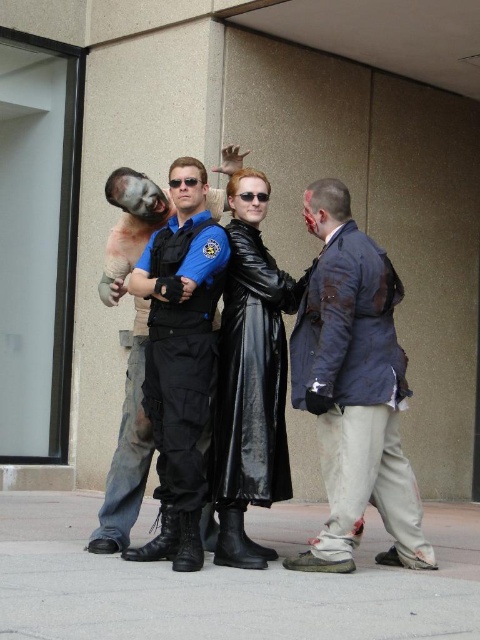
Question: Does matte black uniform at center have a greater width compared to black matte sunglasses at center?

Choices:
 (A) yes
 (B) no

Answer: (A)

Question: Is dark blue suit at right below sunglasses at center?

Choices:
 (A) yes
 (B) no

Answer: (A)

Question: Which is farther from the black matte sunglasses at center?

Choices:
 (A) matte black uniform at center
 (B) sunglasses at center
 (C) dark blue suit at right

Answer: (C)

Question: Considering the real-world distances, which object is farthest from the dark blue suit at right?

Choices:
 (A) sunglasses at center
 (B) black matte sunglasses at center
 (C) matte black uniform at center

Answer: (A)

Question: Does dark blue suit at right have a greater width compared to black matte sunglasses at center?

Choices:
 (A) yes
 (B) no

Answer: (A)

Question: Which object is the closest to the sunglasses at center?

Choices:
 (A) matte black uniform at center
 (B) black matte sunglasses at center

Answer: (B)